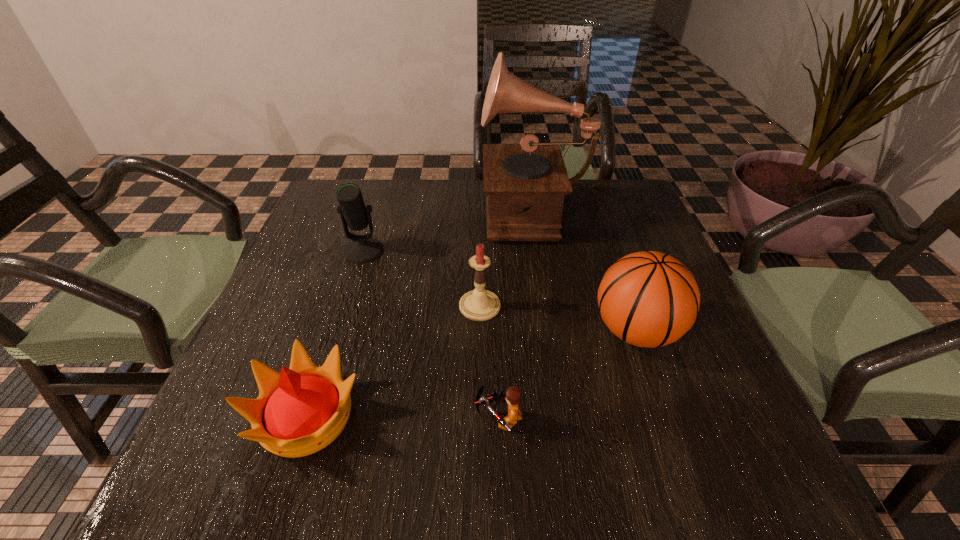
This screenshot has height=540, width=960. I want to click on blank region between the basketball and the microphone, so click(500, 291).

This screenshot has width=960, height=540. Identify the location of vacant area that lies between the candle and the crown. (393, 361).

You are a GUI agent. You are given a task and a screenshot of the screen. Output one action in this format:
    pyautogui.click(x=<x>, y=<y>)
    Task: Click on the free space between the tallest object and the basketball
    This screenshot has height=540, width=960.
    Given the screenshot: What is the action you would take?
    pyautogui.click(x=585, y=270)

You are a GUI agent. You are given a task and a screenshot of the screen. Output one action in this format:
    pyautogui.click(x=<x>, y=<y>)
    Task: Click on the free space between the microphone and the tallest object
    Image resolution: width=960 pixels, height=540 pixels.
    Given the screenshot: What is the action you would take?
    pyautogui.click(x=448, y=230)

Identify the location of vacant point located between the record player and the basketball. (585, 270).

You are a GUI agent. You are given a task and a screenshot of the screen. Output one action in this format:
    pyautogui.click(x=<x>, y=<y>)
    Task: Click on the free spot between the candle and the microphone
    This screenshot has height=540, width=960.
    Given the screenshot: What is the action you would take?
    pyautogui.click(x=421, y=279)

The image size is (960, 540). Find the location of `empty location between the Lego and the candle`. empty location between the Lego and the candle is located at coordinates (489, 362).

At what (x,y) coordinates should I click in order to perform the action: click on empty location between the candle and the basketball. Please return your answer as a coordinate pair (x, y). This screenshot has height=540, width=960. Looking at the image, I should click on (558, 319).

Where is `vacant area between the basketball and the microphone`? The height and width of the screenshot is (540, 960). vacant area between the basketball and the microphone is located at coordinates (500, 291).

Identify the location of object that is the second closest to the microphone. (525, 184).